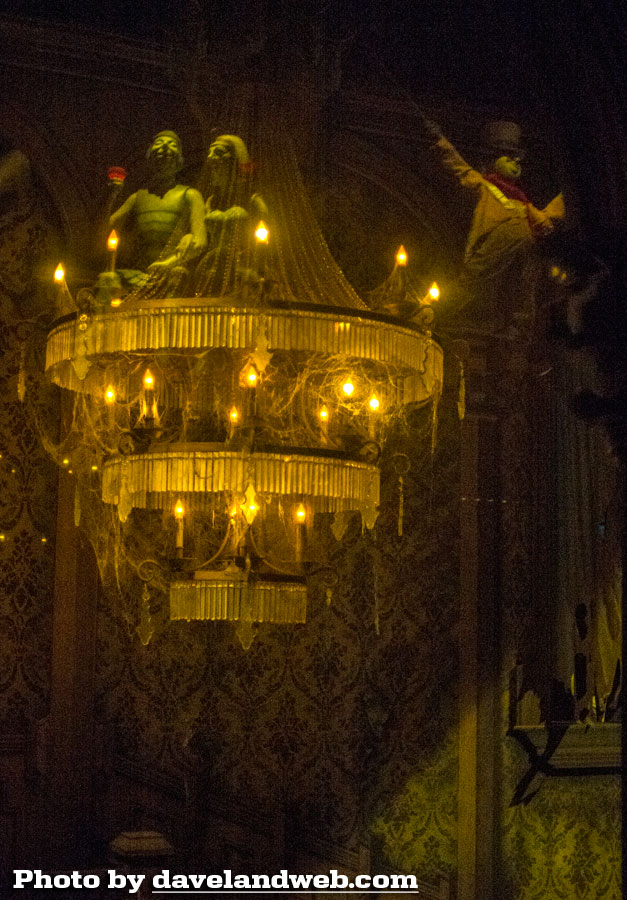
Locate an element on the screen. statues on the left is located at coordinates (148, 194), (228, 140).